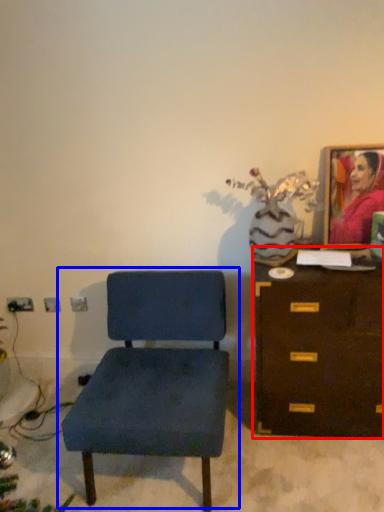
Question: Among these objects, which one is nearest to the camera, chest of drawers (highlighted by a red box) or chair (highlighted by a blue box)?

Choices:
 (A) chest of drawers
 (B) chair

Answer: (B)